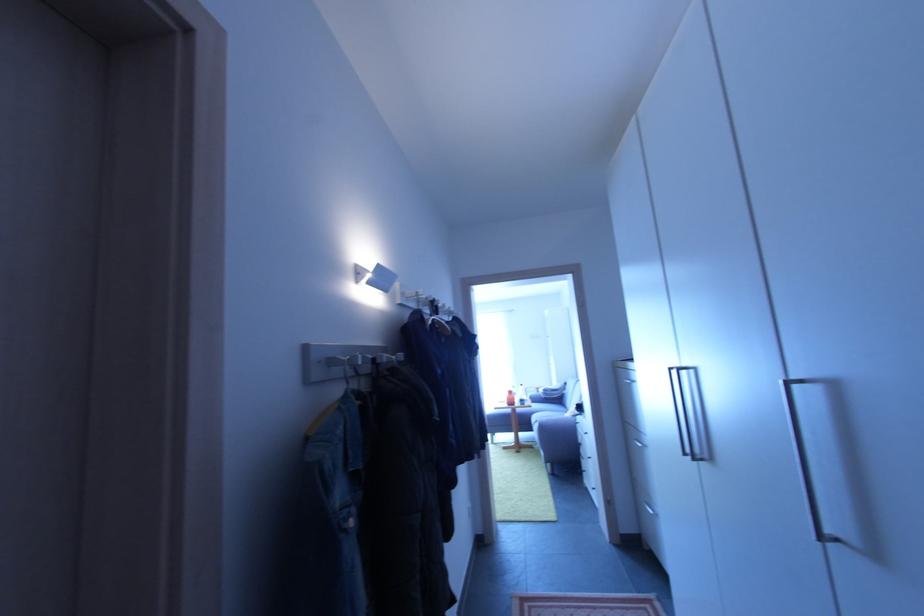
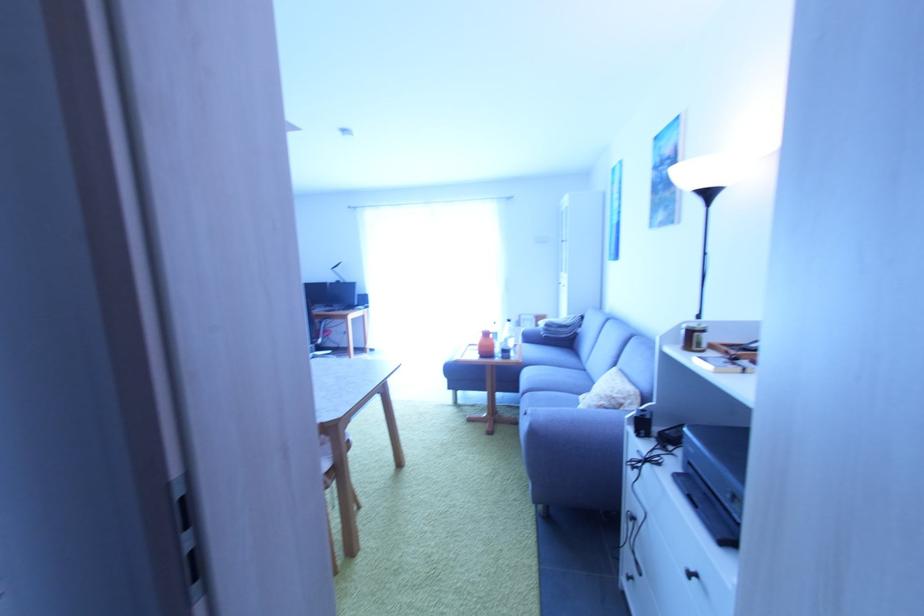
The point at (515,394) is marked in the first image. Where is the corresponding point in the second image?

(492, 336)